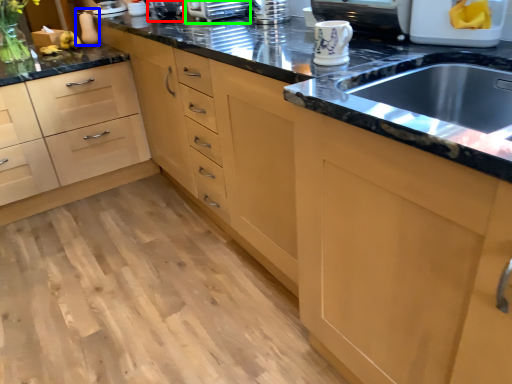
Question: Based on their relative distances, which object is nearer to appliance (highlighted by a red box)? Choose from appliance (highlighted by a blue box) and appliance (highlighted by a green box).

Choices:
 (A) appliance
 (B) appliance

Answer: (B)